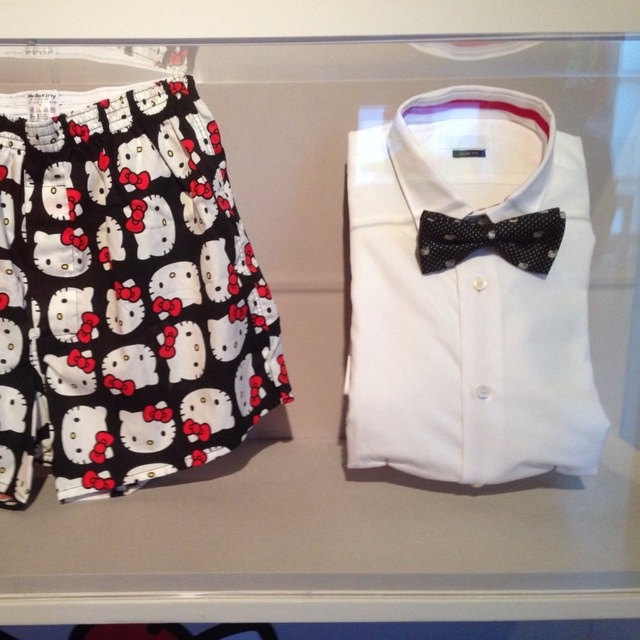
You are standing in a store looking at the printed cotton shorts at left displayed on a shelf. If the store requires you to be at least 4 feet away from the merchandise to prevent theft, are you currently within the allowed distance?

The distance between you and the printed cotton shorts at left is 3.31 feet, which is less than the required 4 feet. Therefore, you are too close and need to step back to comply with the store policy.

You are standing in front of a display case with two points marked inside it. The first point is at coordinate point (188,184) and the second is at point (545,104). If you look into the case, which point appears closer to you?

Point (545,104) appears closer to you because the Objects Description states that point (188,184) is behind point (545,104).